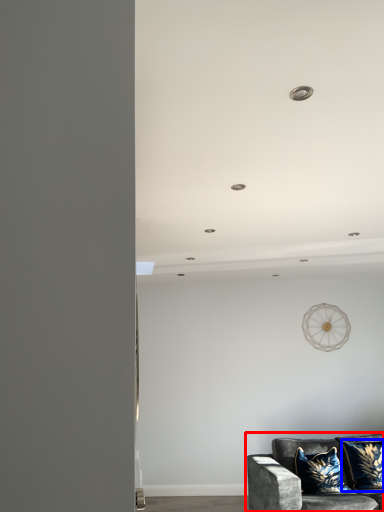
Question: Which point is closer to the camera, studio couch (highlighted by a red box) or pillow (highlighted by a blue box)?

Choices:
 (A) studio couch
 (B) pillow

Answer: (A)